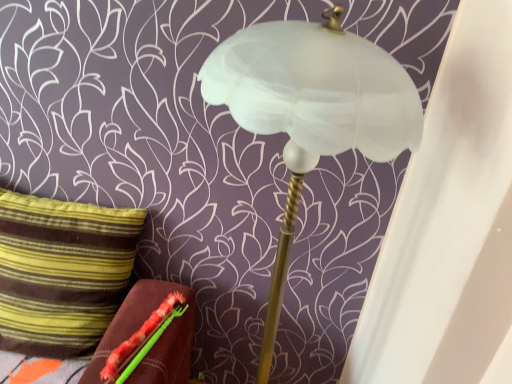
Question: Is green fuzzy brush at lower left positioned behind striped fabric pillow at left?

Choices:
 (A) no
 (B) yes

Answer: (A)

Question: From a real-world perspective, is green fuzzy brush at lower left under striped fabric pillow at left?

Choices:
 (A) yes
 (B) no

Answer: (A)

Question: Considering the relative sizes of green fuzzy brush at lower left and striped fabric pillow at left in the image provided, is green fuzzy brush at lower left smaller than striped fabric pillow at left?

Choices:
 (A) yes
 (B) no

Answer: (A)

Question: Does green fuzzy brush at lower left have a greater height compared to striped fabric pillow at left?

Choices:
 (A) yes
 (B) no

Answer: (B)

Question: Does green fuzzy brush at lower left appear on the right side of striped fabric pillow at left?

Choices:
 (A) yes
 (B) no

Answer: (A)

Question: From a real-world perspective, is green fuzzy brush at lower left over striped fabric pillow at left?

Choices:
 (A) no
 (B) yes

Answer: (A)

Question: Is white frosted glass lamp at center bigger than green fuzzy brush at lower left?

Choices:
 (A) yes
 (B) no

Answer: (A)

Question: Is white frosted glass lamp at center positioned behind green fuzzy brush at lower left?

Choices:
 (A) yes
 (B) no

Answer: (B)

Question: Could you tell me if white frosted glass lamp at center is facing green fuzzy brush at lower left?

Choices:
 (A) no
 (B) yes

Answer: (A)

Question: Does white frosted glass lamp at center touch green fuzzy brush at lower left?

Choices:
 (A) yes
 (B) no

Answer: (B)

Question: From the image's perspective, would you say white frosted glass lamp at center is positioned over green fuzzy brush at lower left?

Choices:
 (A) yes
 (B) no

Answer: (A)

Question: Does white frosted glass lamp at center come in front of green fuzzy brush at lower left?

Choices:
 (A) no
 (B) yes

Answer: (B)

Question: Is striped fabric pillow at left at the back of white frosted glass lamp at center?

Choices:
 (A) yes
 (B) no

Answer: (B)